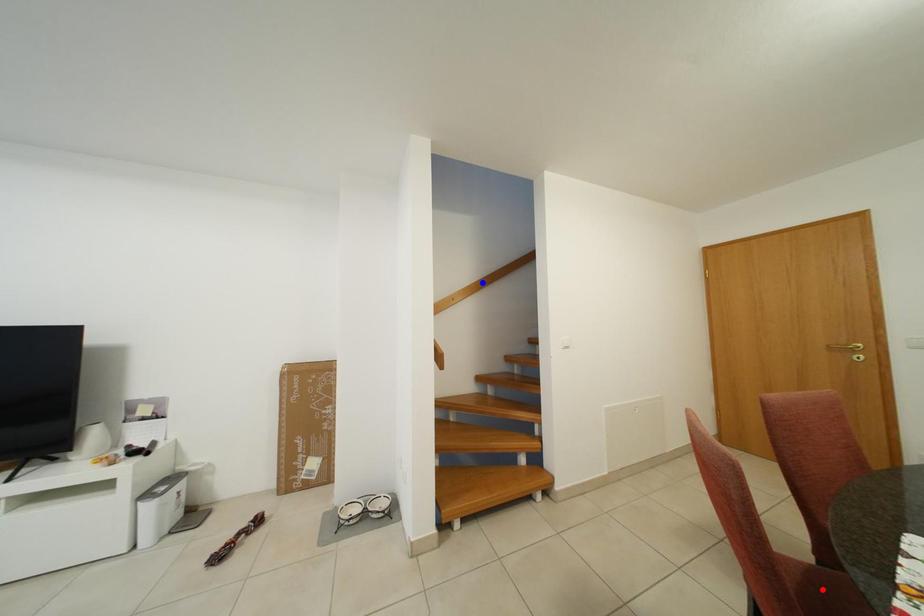
Question: Which of the two points in the image is closer to the camera?

Choices:
 (A) Blue point is closer.
 (B) Red point is closer.

Answer: (B)